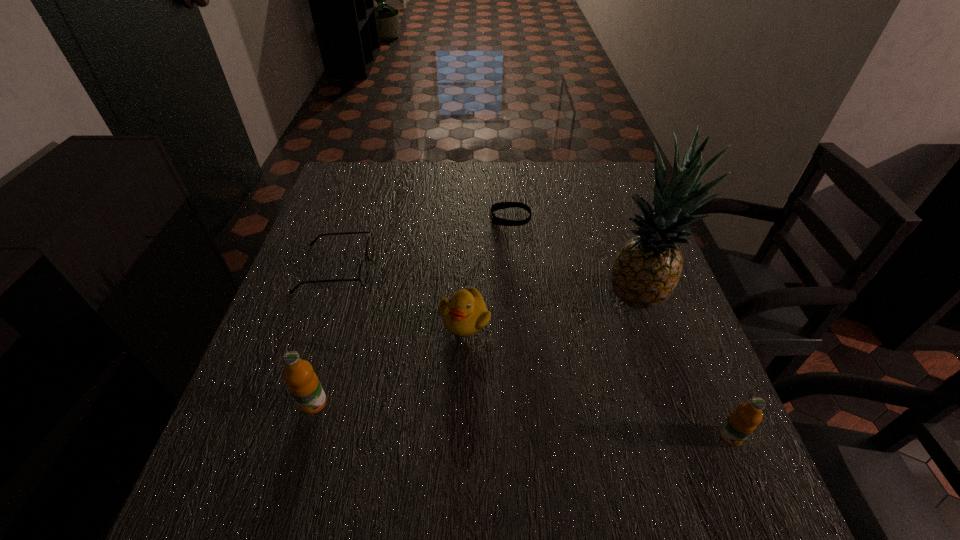
This screenshot has width=960, height=540. Identify the location of pineapple that is at the right edge. (647, 269).

Where is `object that is at the near left corner`? object that is at the near left corner is located at coordinates (303, 383).

What are the coordinates of `object present at the near right corner` in the screenshot? It's located at (742, 422).

The width and height of the screenshot is (960, 540). In order to click on vacant position at the far edge of the desktop in this screenshot , I will do `click(434, 162)`.

Where is `blank space at the near edge of the desktop`? blank space at the near edge of the desktop is located at coordinates (459, 430).

This screenshot has width=960, height=540. Find the location of `free spot at the left edge of the desktop`. free spot at the left edge of the desktop is located at coordinates (327, 252).

Find the location of `free space at the right edge`. free space at the right edge is located at coordinates (650, 393).

Locate an element on the screen. free space at the far left corner of the desktop is located at coordinates (361, 185).

Where is `vacant space at the far right corner of the desktop`? This screenshot has width=960, height=540. vacant space at the far right corner of the desktop is located at coordinates (577, 171).

You are a GUI agent. You are given a task and a screenshot of the screen. Output one action in this format:
    pyautogui.click(x=<x>, y=<y>)
    Task: Click on the free spot between the pineapple and the second shortest object
    This screenshot has width=960, height=540.
    Given the screenshot: What is the action you would take?
    pyautogui.click(x=488, y=283)